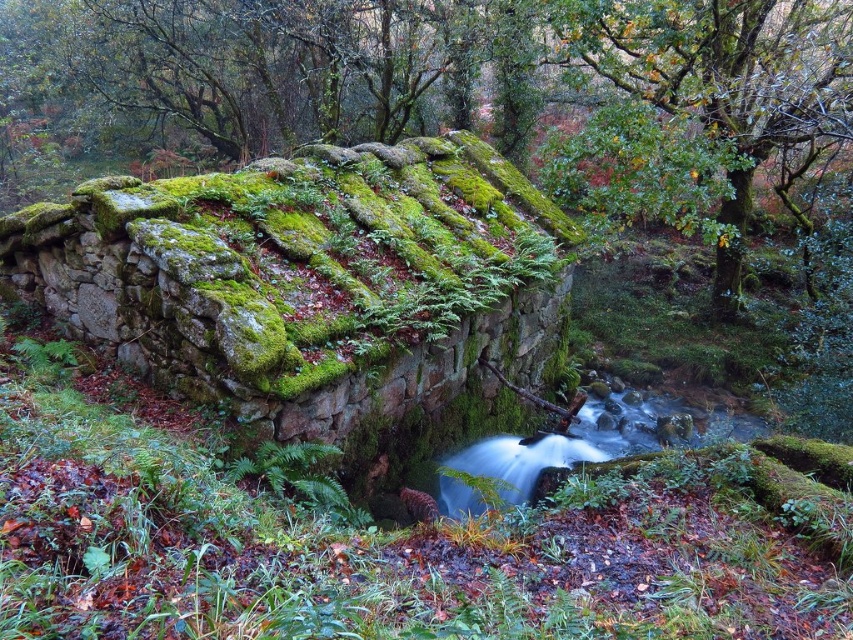
Between green mossy stone wall at center and clear water at center, which one is positioned lower?

clear water at center is below.

This screenshot has width=853, height=640. What do you see at coordinates (310, 284) in the screenshot?
I see `green mossy stone wall at center` at bounding box center [310, 284].

You are a GUI agent. You are given a task and a screenshot of the screen. Output one action in this format:
    pyautogui.click(x=<x>, y=<y>)
    Task: Click on the green mossy stone wall at center
    This screenshot has height=640, width=853.
    Given the screenshot: What is the action you would take?
    pyautogui.click(x=310, y=284)